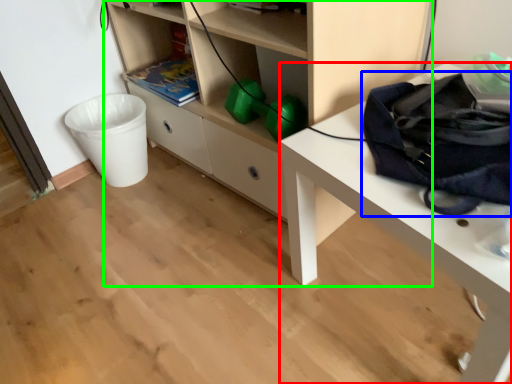
Question: Based on their relative distances, which object is farther from desk (highlighted by a red box)? Choose from messenger bag (highlighted by a blue box) and shelf (highlighted by a green box).

Choices:
 (A) messenger bag
 (B) shelf

Answer: (B)